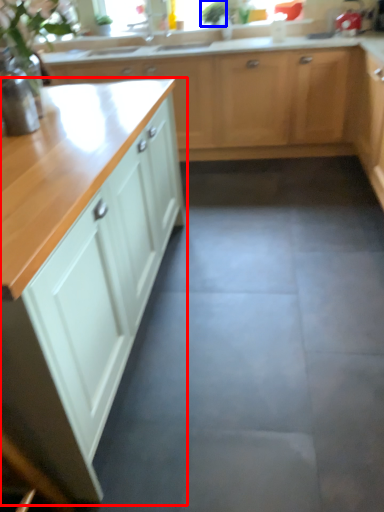
Question: Which object is closer to the camera taking this photo, cabinetry (highlighted by a red box) or plant (highlighted by a blue box)?

Choices:
 (A) cabinetry
 (B) plant

Answer: (A)